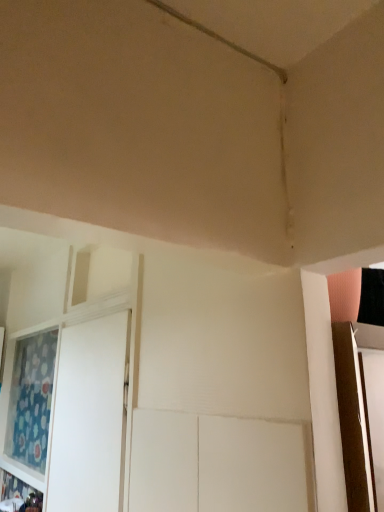
What do you see at coordinates (90, 417) in the screenshot? The width and height of the screenshot is (384, 512). I see `white glossy screen door at left` at bounding box center [90, 417].

The image size is (384, 512). I want to click on white glossy screen door at left, so click(x=90, y=417).

What do you see at coordinates (31, 399) in the screenshot? I see `blue floral fabric curtain at left` at bounding box center [31, 399].

Measure the distance between blue floral fabric curtain at left and camera.

Answer: 2.09 meters.

This screenshot has width=384, height=512. Find the location of `blue floral fabric curtain at left`. blue floral fabric curtain at left is located at coordinates (31, 399).

In order to face blue floral fabric curtain at left, should I rotate leftwards or rightwards?

Rotate left and turn 20.033 degrees.

Where is `white glossy screen door at left`? The width and height of the screenshot is (384, 512). white glossy screen door at left is located at coordinates (90, 417).

Which object is positioned more to the right, blue floral fabric curtain at left or white glossy screen door at left?

white glossy screen door at left is more to the right.

Is blue floral fabric curtain at left in front of or behind white glossy screen door at left in the image?

blue floral fabric curtain at left is behind white glossy screen door at left.

Which is further, (41, 358) or (110, 317)?

The point (41, 358) is farther from the camera.

From the image's perspective, is blue floral fabric curtain at left under white glossy screen door at left?

Correct, blue floral fabric curtain at left appears lower than white glossy screen door at left in the image.

From a real-world perspective, between blue floral fabric curtain at left and white glossy screen door at left, who is vertically lower?

white glossy screen door at left.

Which of these two, blue floral fabric curtain at left or white glossy screen door at left, is wider?

white glossy screen door at left is wider.

Can you confirm if blue floral fabric curtain at left is shorter than white glossy screen door at left?

Correct, blue floral fabric curtain at left is not as tall as white glossy screen door at left.

In terms of size, does blue floral fabric curtain at left appear bigger or smaller than white glossy screen door at left?

In the image, blue floral fabric curtain at left appears to be larger than white glossy screen door at left.

Would you say blue floral fabric curtain at left is inside or outside white glossy screen door at left?

blue floral fabric curtain at left is spatially situated outside white glossy screen door at left.

Can you see blue floral fabric curtain at left touching white glossy screen door at left?

They are not placed beside each other.

Is blue floral fabric curtain at left positioned with its back to white glossy screen door at left?

No, blue floral fabric curtain at left is not facing away from white glossy screen door at left.

How many degrees apart are the facing directions of blue floral fabric curtain at left and white glossy screen door at left?

The facing directions of blue floral fabric curtain at left and white glossy screen door at left are 0.985 degrees apart.

Where is `screen door in front of the blue floral fabric curtain at left`? This screenshot has width=384, height=512. screen door in front of the blue floral fabric curtain at left is located at coordinates (90, 417).

Would you say white glossy screen door at left is to the left or to the right of blue floral fabric curtain at left in the picture?

Based on their positions, white glossy screen door at left is located to the right of blue floral fabric curtain at left.

Does white glossy screen door at left lie in front of blue floral fabric curtain at left?

Yes.

Is point (100, 395) farther from viewer compared to point (36, 438)?

No, (100, 395) is closer to viewer.

From the image's perspective, does white glossy screen door at left appear higher than blue floral fabric curtain at left?

Indeed, from the image's perspective, white glossy screen door at left is shown above blue floral fabric curtain at left.

From a real-world perspective, which is physically below, white glossy screen door at left or blue floral fabric curtain at left?

white glossy screen door at left.

Is white glossy screen door at left wider or thinner than blue floral fabric curtain at left?

Clearly, white glossy screen door at left has more width compared to blue floral fabric curtain at left.

Considering the sizes of objects white glossy screen door at left and blue floral fabric curtain at left in the image provided, who is taller, white glossy screen door at left or blue floral fabric curtain at left?

white glossy screen door at left.

Looking at the image, does white glossy screen door at left seem bigger or smaller compared to blue floral fabric curtain at left?

Considering their sizes, white glossy screen door at left takes up less space than blue floral fabric curtain at left.

Would you say white glossy screen door at left is outside blue floral fabric curtain at left?

Indeed, white glossy screen door at left is completely outside blue floral fabric curtain at left.

Is white glossy screen door at left beside blue floral fabric curtain at left?

No, white glossy screen door at left is not making contact with blue floral fabric curtain at left.

Is white glossy screen door at left aimed at blue floral fabric curtain at left?

No, white glossy screen door at left is not aimed at blue floral fabric curtain at left.

This screenshot has width=384, height=512. In order to click on curtain above the white glossy screen door at left (from a real-world perspective) in this screenshot , I will do `click(31, 399)`.

Where is `screen door above the blue floral fabric curtain at left (from the image's perspective)`? The image size is (384, 512). screen door above the blue floral fabric curtain at left (from the image's perspective) is located at coordinates (90, 417).

What are the coordinates of `curtain to the left of white glossy screen door at left` in the screenshot? It's located at (31, 399).